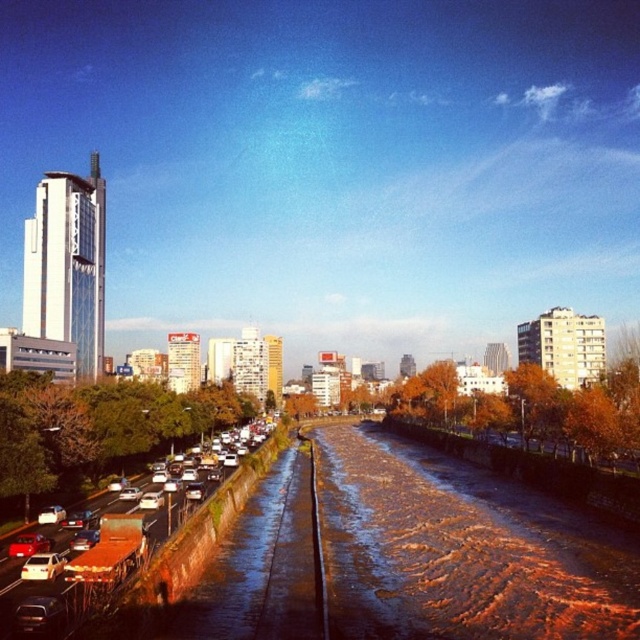
Is metallic silver cars at left taller than matte red car at lower left?

Correct, metallic silver cars at left is much taller as matte red car at lower left.

Is metallic silver cars at left thinner than matte red car at lower left?

Incorrect, metallic silver cars at left's width is not less than matte red car at lower left's.

I want to click on metallic silver cars at left, so click(148, 563).

Can you confirm if metallic silver sedan at lower left is bigger than matte red car at lower left?

Incorrect, metallic silver sedan at lower left is not larger than matte red car at lower left.

Is metallic silver sedan at lower left taller than matte red car at lower left?

No, metallic silver sedan at lower left is not taller than matte red car at lower left.

Image resolution: width=640 pixels, height=640 pixels. Identify the location of metallic silver sedan at lower left. (42, 566).

Who is positioned more to the right, metallic silver cars at left or metallic silver sedan at lower left?

metallic silver cars at left is more to the right.

Does point (198, 518) come in front of point (52, 566)?

No, it is not.

Find the location of a particular element. This screenshot has height=640, width=640. metallic silver cars at left is located at coordinates (148, 563).